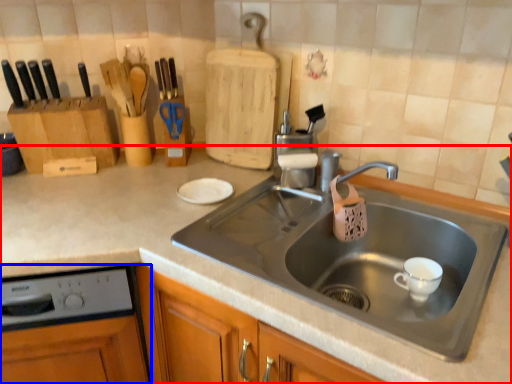
Question: Among these objects, which one is nearest to the camera, countertop (highlighted by a red box) or dish washer (highlighted by a blue box)?

Choices:
 (A) countertop
 (B) dish washer

Answer: (A)